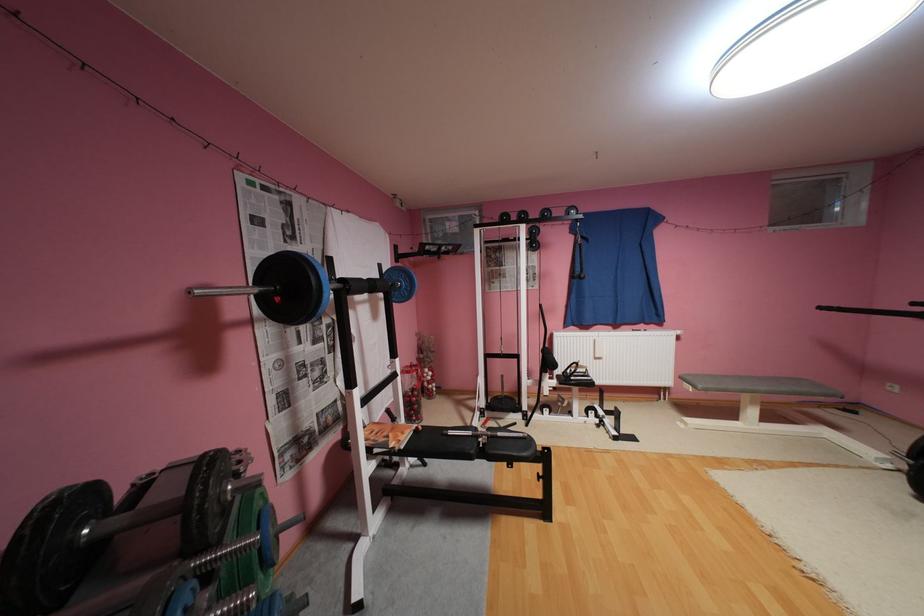
Find where to grip the barbell bar. Please return your answer as a coordinate pair (x, y).

(253, 290)